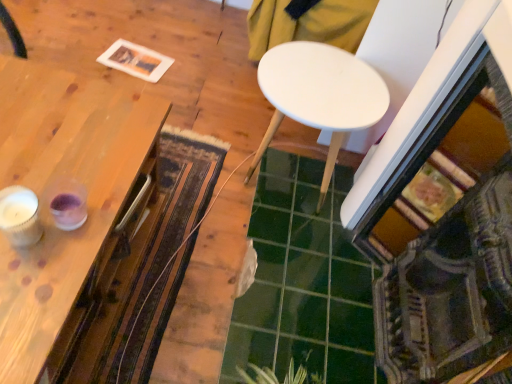
Identify the location of vacant space underneath textured woolen mat at center (from a real-world perspective). This screenshot has width=512, height=384. tap(170, 218).